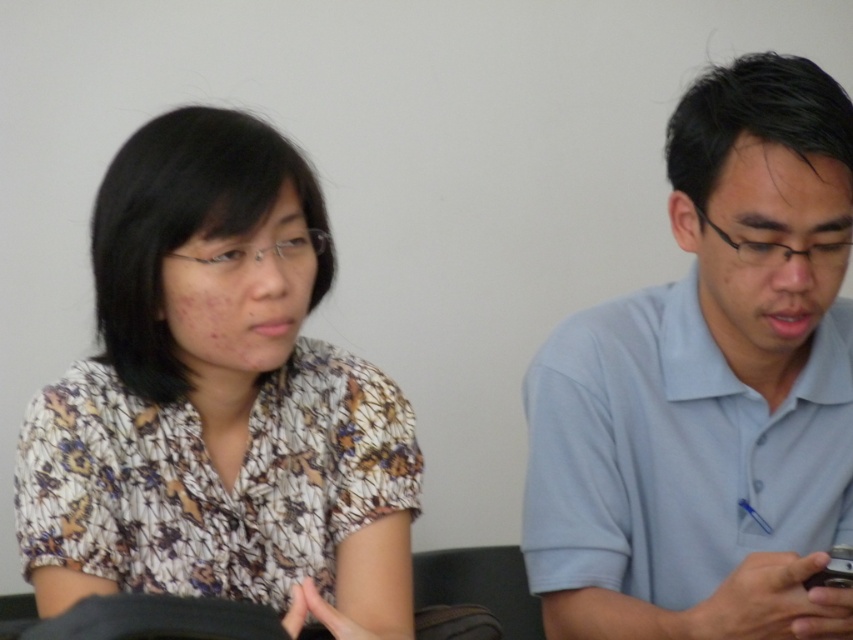
Question: Is floral fabric blouse at left smaller than light blue cotton shirt at right?

Choices:
 (A) no
 (B) yes

Answer: (B)

Question: Is floral fabric blouse at left positioned at the back of light blue cotton shirt at right?

Choices:
 (A) no
 (B) yes

Answer: (A)

Question: Which point is farther to the camera?

Choices:
 (A) floral fabric blouse at left
 (B) light blue cotton shirt at right

Answer: (B)

Question: Does floral fabric blouse at left have a greater width compared to light blue cotton shirt at right?

Choices:
 (A) yes
 (B) no

Answer: (A)